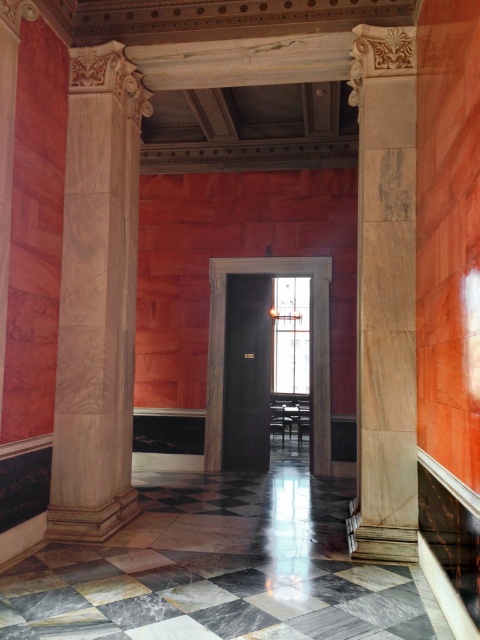
You are standing at the entrance of the hallway and want to walk straight ahead. There is a marble column at center in your path. Where should you move to avoid it?

The marble column at center is located at point (x=96, y=298), so you should move to either the left or right side of the hallway to avoid it.

You are standing in the hallway and want to move towards the white marble column at right. Based on its 2D location coordinates, which direction should you move relative to your current position? Please state the direction as a cardinal direction or diagonal direction like northeast, northwest, etc.

The white marble column at right is located at coordinates 0.459 on the x axis and 0.804 on the y axis. Since the coordinate system is normalized between 0 and 1, with (x=0, y=0) being the bottom left corner and (x=479, y=639) being the top right corner, the column is positioned towards the upper right quadrant. Therefore, you should move northeast to reach it.

You are an interior designer assessing the hallway. You need to place a 1.2 meter wide decorative panel between the marble column at center and the white marble column at right. Can the space between them accommodate the panel?

The marble column at center might be wider than white marble column at right, so the space between them may not be sufficient to fit a 1.2 meter wide decorative panel. Further measurements are needed to confirm.